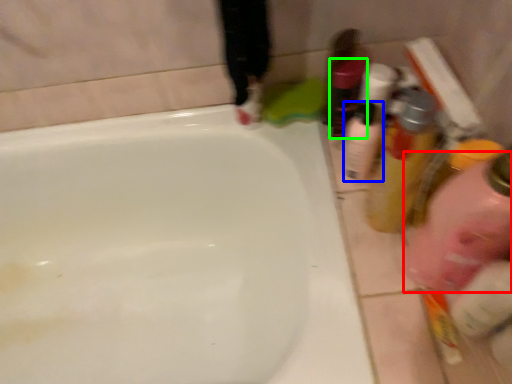
Question: Which is farther away from cleaning product (highlighted by a red box)? mouthwash (highlighted by a blue box) or toiletry (highlighted by a green box)?

Choices:
 (A) mouthwash
 (B) toiletry

Answer: (B)